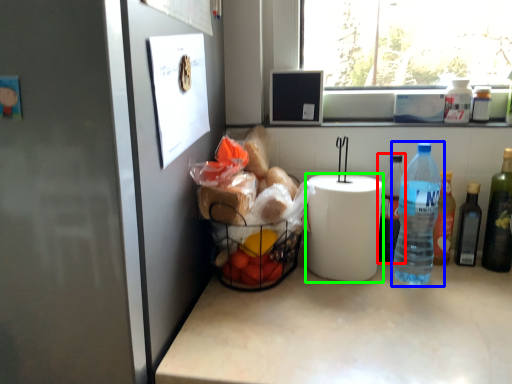
Question: Which is nearer to the bottle (highlighted by a red box)? bottle (highlighted by a blue box) or paper towel (highlighted by a green box).

Choices:
 (A) bottle
 (B) paper towel

Answer: (A)